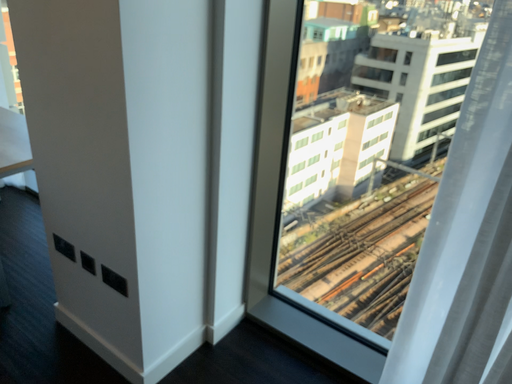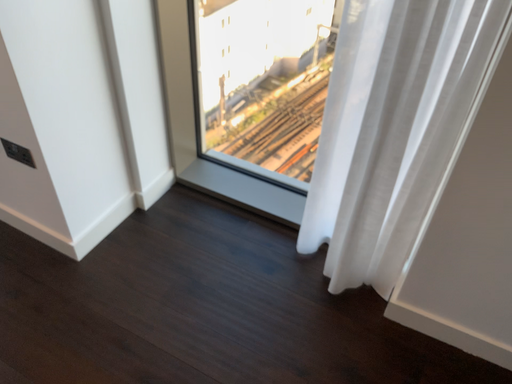
Question: Which way did the camera rotate in the video?

Choices:
 (A) rotated downward
 (B) rotated upward

Answer: (A)